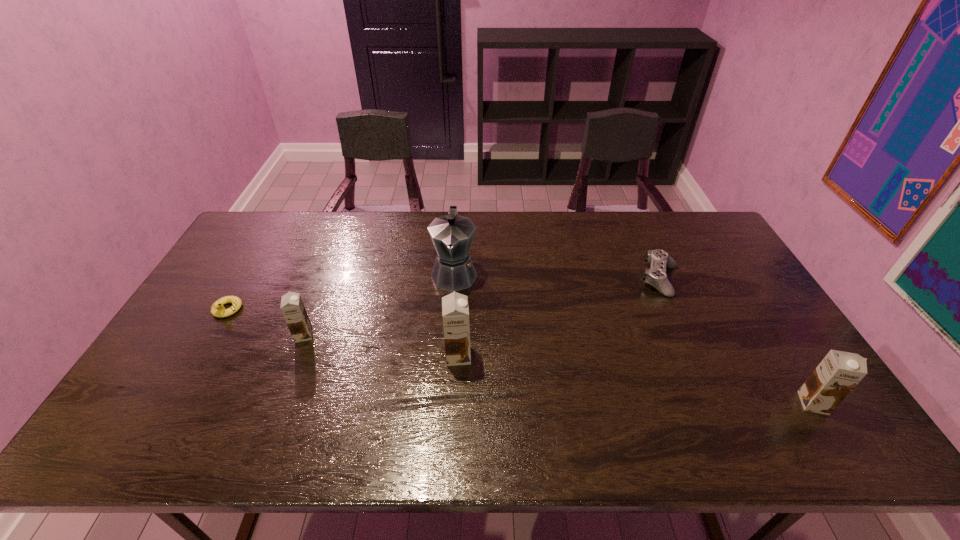
This screenshot has width=960, height=540. What are the coordinates of `free space between the fifth object from left to right and the second chocolate milk from right to left` in the screenshot? It's located at (559, 318).

Where is `vacant space in between the nearest object and the second nearest chocolate milk`? This screenshot has height=540, width=960. vacant space in between the nearest object and the second nearest chocolate milk is located at coordinates (636, 380).

I want to click on empty location between the fifth object from left to right and the second chocolate milk from right to left, so click(x=559, y=318).

Find the location of a particular element. The width and height of the screenshot is (960, 540). free space between the control and the leftmost chocolate milk is located at coordinates (482, 307).

At what (x,y) coordinates should I click in order to perform the action: click on blank region between the nearest object and the third farthest object. Please return your answer as a coordinate pair (x, y). Looking at the image, I should click on (520, 356).

The width and height of the screenshot is (960, 540). What are the coordinates of `object that is the nearest to the rightmost chocolate milk` in the screenshot? It's located at (656, 276).

Choose which object is the fifth nearest neighbor to the coffeepot. Please provide its 2D coordinates. Your answer should be formatted as a tuple, i.e. [(x, y)], where the tuple contains the x and y coordinates of a point satisfying the conditions above.

[(839, 372)]

Select which chocolate milk appears as the closest to the coffeepot. Please provide its 2D coordinates. Your answer should be formatted as a tuple, i.e. [(x, y)], where the tuple contains the x and y coordinates of a point satisfying the conditions above.

[(455, 312)]

Find the location of `the second closest chocolate milk to the coffeepot`. the second closest chocolate milk to the coffeepot is located at coordinates (292, 307).

Locate an element on the screen. This screenshot has height=540, width=960. vacant space that satisfies the following two spatial constraints: 1. at the spout of the nearest chocolate milk; 2. on the left side of the coffeepot is located at coordinates (x=445, y=403).